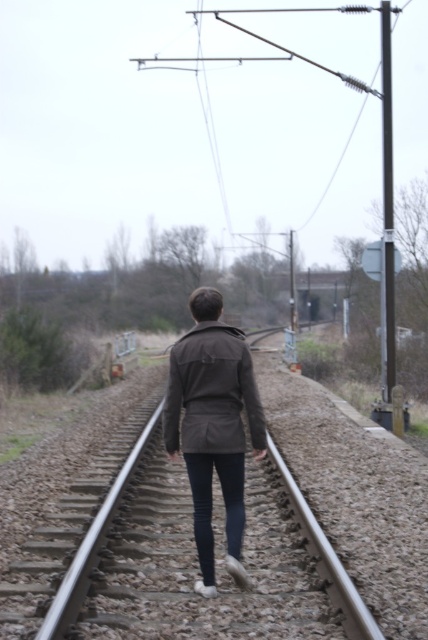
The image size is (428, 640). What do you see at coordinates (214, 426) in the screenshot? I see `dark brown jacket at center` at bounding box center [214, 426].

Who is taller, dark brown jacket at center or smooth metal train track at center?

With more height is dark brown jacket at center.

Between point (216, 316) and point (366, 612), which one is positioned behind?

Positioned behind is point (216, 316).

You are a GUI agent. You are given a task and a screenshot of the screen. Output one action in this format:
    pyautogui.click(x=<x>, y=<y>)
    Task: Click on the dark brown jacket at center
    Image resolution: width=428 pixels, height=640 pixels.
    Given the screenshot: What is the action you would take?
    pyautogui.click(x=214, y=426)

Can you confirm if dark brown matte jacket at center is positioned above smooth metal train track at center?

Yes.

Is point (207, 326) positioned in front of point (302, 508)?

Yes, point (207, 326) is in front of point (302, 508).

Locate an element on the screen. dark brown matte jacket at center is located at coordinates (211, 392).

Find the location of a particular element. The height and width of the screenshot is (640, 428). dark brown matte jacket at center is located at coordinates (211, 392).

Find the location of a particular element. Image resolution: width=428 pixels, height=640 pixels. dark brown jacket at center is located at coordinates (214, 426).

Can you confirm if dark brown jacket at center is taller than dark brown matte jacket at center?

Yes, dark brown jacket at center is taller than dark brown matte jacket at center.

Find the location of a particular element. The width and height of the screenshot is (428, 640). dark brown jacket at center is located at coordinates (214, 426).

Image resolution: width=428 pixels, height=640 pixels. I want to click on dark brown jacket at center, so click(214, 426).